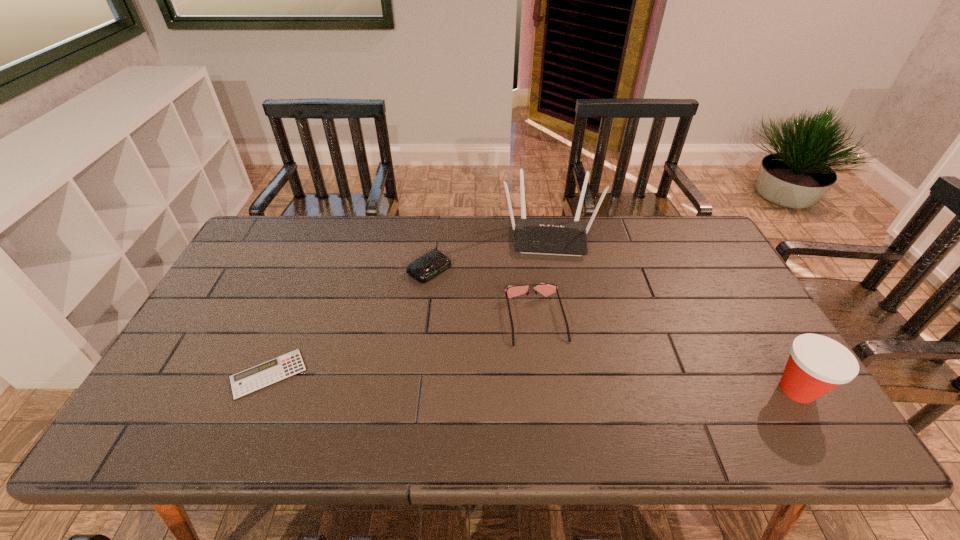
Locate an element on the screen. The width and height of the screenshot is (960, 540). free location at the left edge of the desktop is located at coordinates (229, 284).

Identify the location of free region at the right edge of the desktop. (749, 314).

This screenshot has height=540, width=960. In order to click on vacant region at the far left corner in this screenshot , I will do `click(289, 221)`.

Locate an element on the screen. free point between the rightmost object and the leftmost object is located at coordinates (533, 382).

Identify the location of vacant point located between the sunglasses and the calculator. The width and height of the screenshot is (960, 540). (402, 346).

This screenshot has width=960, height=540. I want to click on free space that is in between the second object from left to right and the sunglasses, so click(x=483, y=294).

The height and width of the screenshot is (540, 960). In order to click on vacant space that's between the alarm clock and the third farthest object in this screenshot , I will do `click(483, 294)`.

This screenshot has height=540, width=960. I want to click on unoccupied position between the second object from left to right and the leftmost object, so click(x=349, y=321).

I want to click on unoccupied position between the second tallest object and the alarm clock, so click(x=613, y=329).

This screenshot has height=540, width=960. What are the coordinates of `empty space between the alarm clock and the fourth shortest object` in the screenshot? It's located at (613, 329).